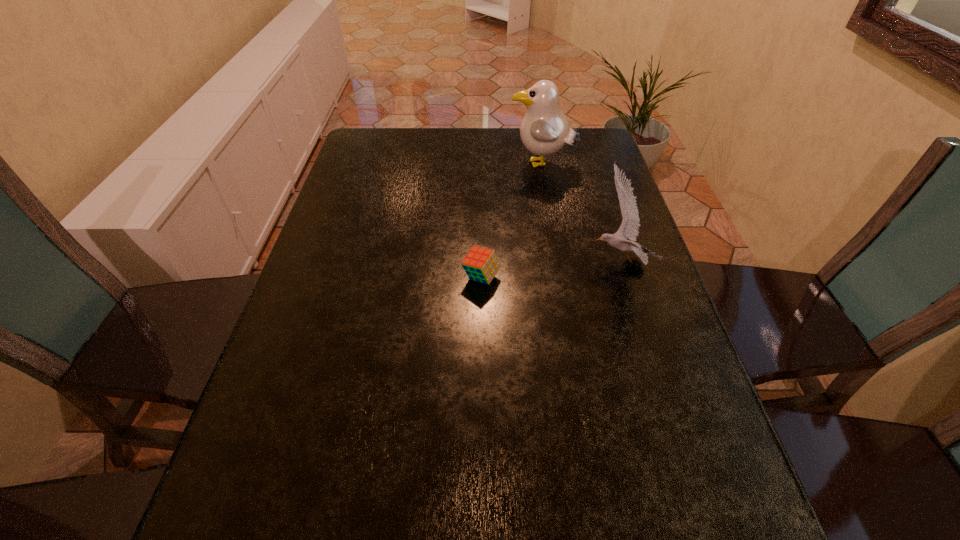
The height and width of the screenshot is (540, 960). What are the coordinates of `the farther gull` in the screenshot? It's located at (544, 130).

I want to click on the taller gull, so click(x=544, y=130).

Locate an element on the screen. This screenshot has width=960, height=540. the shorter gull is located at coordinates (630, 225).

Where is `the nearer gull`? The image size is (960, 540). the nearer gull is located at coordinates (630, 225).

Identify the location of the leftmost object. This screenshot has height=540, width=960. (481, 264).

I want to click on cube, so click(x=481, y=264).

The width and height of the screenshot is (960, 540). I want to click on vacant space located on the beak of the taller gull, so click(x=421, y=165).

I want to click on vacant space located on the beak of the taller gull, so coord(486,165).

The height and width of the screenshot is (540, 960). What are the coordinates of `vacant space located on the beak of the taller gull` in the screenshot? It's located at (467, 165).

The width and height of the screenshot is (960, 540). What are the coordinates of `vacant area situated at the tip of the beak of the shorter gull` in the screenshot? It's located at (451, 261).